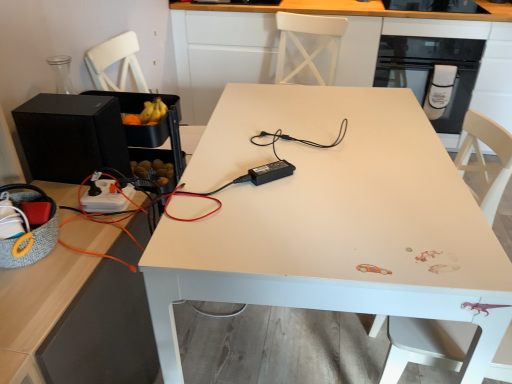
Image resolution: width=512 pixels, height=384 pixels. Identify the location of vacant area that lies to the right of black plastic power adapter at center, positioned as the first appliance in front-to-back order. (337, 185).